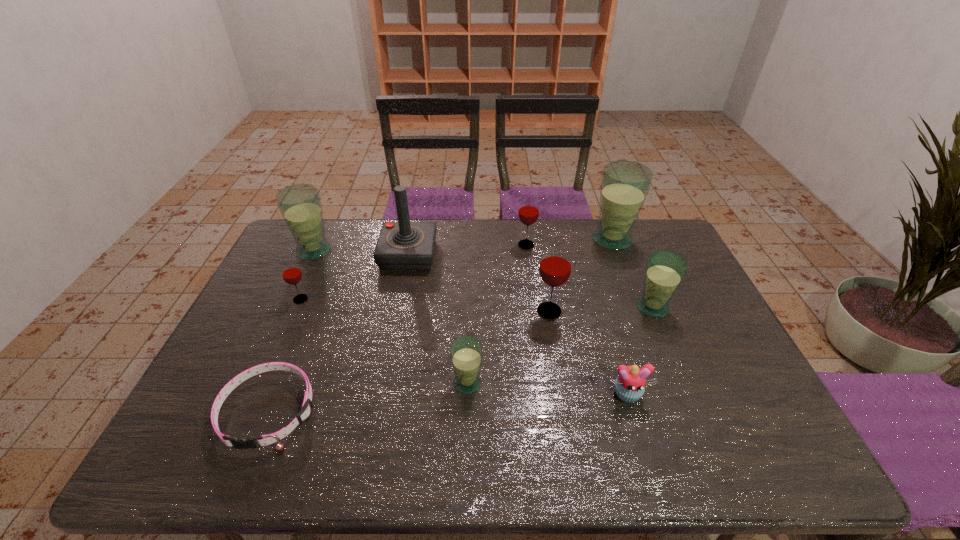
In the image, there is a desktop. At what (x,y) coordinates should I click in order to perform the action: click on vacant space at the left edge. Please return your answer as a coordinate pair (x, y). The width and height of the screenshot is (960, 540). Looking at the image, I should click on (200, 418).

The width and height of the screenshot is (960, 540). Find the location of `vacant region at the right edge`. vacant region at the right edge is located at coordinates (692, 355).

What are the coordinates of `vacant area at the far left corner` in the screenshot? It's located at (289, 253).

I want to click on vacant space at the near right corner of the desktop, so pyautogui.click(x=770, y=453).

At what (x,y) coordinates should I click in order to perform the action: click on vacant area between the third farthest blue glass and the red joystick. Please return your answer as a coordinate pair (x, y). Image resolution: width=960 pixels, height=540 pixels. Looking at the image, I should click on (531, 281).

Locate an element on the screen. The width and height of the screenshot is (960, 540). free space between the biggest red glass and the second blue glass from left to right is located at coordinates (509, 347).

The image size is (960, 540). Find the location of `free space between the second nearest blue glass and the tallest glass`. free space between the second nearest blue glass and the tallest glass is located at coordinates (633, 274).

I want to click on blank region between the second smallest blue glass and the red joystick, so click(531, 281).

You are a GUI agent. You are given a task and a screenshot of the screen. Output one action in this format:
    pyautogui.click(x=<x>, y=<y>)
    Task: Click on the vacant area that lies between the farthest red glass and the second nearest blue glass
    The height and width of the screenshot is (540, 960).
    Given the screenshot: What is the action you would take?
    pyautogui.click(x=589, y=276)

I want to click on vacant area that lies between the nearest glass and the biggest red glass, so click(509, 347).